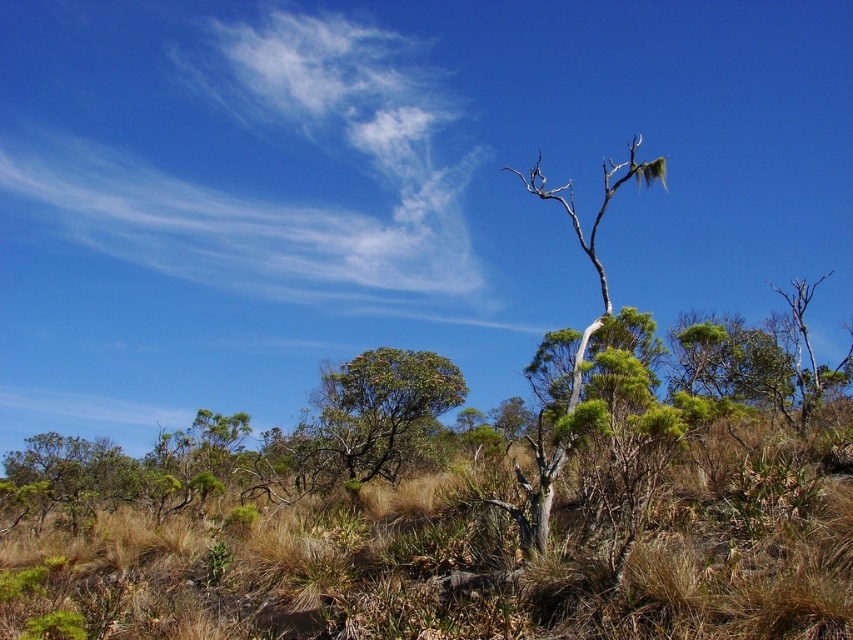
Question: Among these objects, which one is nearest to the camera?

Choices:
 (A) green leafy shrub at center
 (B) gray bark tree at center

Answer: (B)

Question: Which object appears farthest from the camera in this image?

Choices:
 (A) green leafy shrub at center
 (B) gray bark tree at center

Answer: (A)

Question: Is green leafy shrub at center thinner than gray bark tree at center?

Choices:
 (A) yes
 (B) no

Answer: (A)

Question: In this image, where is green leafy shrub at center located relative to gray bark tree at center?

Choices:
 (A) left
 (B) right

Answer: (A)

Question: Does green leafy shrub at center appear under gray bark tree at center?

Choices:
 (A) yes
 (B) no

Answer: (A)

Question: Which point is closer to the camera?

Choices:
 (A) (630, 164)
 (B) (397, 412)

Answer: (A)